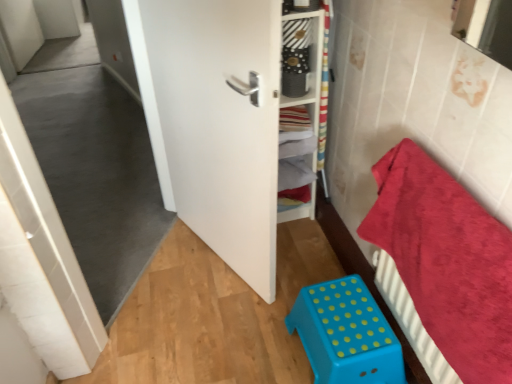
Question: Considering the relative sizes of red plush towel at right and white matte door at center in the image provided, is red plush towel at right smaller than white matte door at center?

Choices:
 (A) yes
 (B) no

Answer: (A)

Question: From the image's perspective, is red plush towel at right located above white matte door at center?

Choices:
 (A) yes
 (B) no

Answer: (B)

Question: Does red plush towel at right lie behind white matte door at center?

Choices:
 (A) no
 (B) yes

Answer: (A)

Question: Is red plush towel at right not close to white matte door at center?

Choices:
 (A) no
 (B) yes

Answer: (A)

Question: Considering the relative positions of red plush towel at right and white matte door at center in the image provided, is red plush towel at right to the left of white matte door at center from the viewer's perspective?

Choices:
 (A) yes
 (B) no

Answer: (B)

Question: Does red plush towel at right come in front of white matte door at center?

Choices:
 (A) yes
 (B) no

Answer: (A)

Question: Is white matte door at center shorter than red plush towel at right?

Choices:
 (A) no
 (B) yes

Answer: (A)

Question: Is white matte door at center next to red plush towel at right?

Choices:
 (A) no
 (B) yes

Answer: (A)

Question: Is white matte door at center to the right of red plush towel at right from the viewer's perspective?

Choices:
 (A) no
 (B) yes

Answer: (A)

Question: Is red plush towel at right located within white matte door at center?

Choices:
 (A) no
 (B) yes

Answer: (A)

Question: Is white matte door at center far from red plush towel at right?

Choices:
 (A) yes
 (B) no

Answer: (B)

Question: Considering the relative sizes of white matte door at center and red plush towel at right in the image provided, is white matte door at center taller than red plush towel at right?

Choices:
 (A) yes
 (B) no

Answer: (A)

Question: Can you confirm if white wooden shelf at center is positioned to the left of white matte door at center?

Choices:
 (A) no
 (B) yes

Answer: (A)